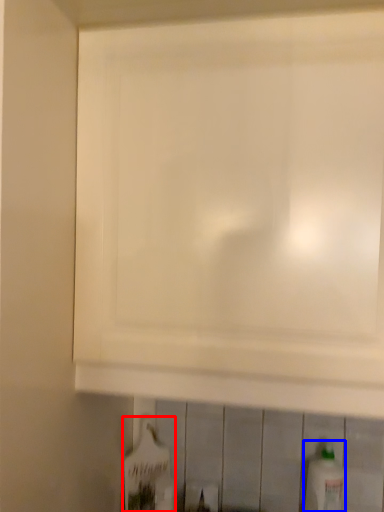
Question: Which of the following is the farthest to the observer, bottle (highlighted by a red box) or bottle (highlighted by a blue box)?

Choices:
 (A) bottle
 (B) bottle

Answer: (A)